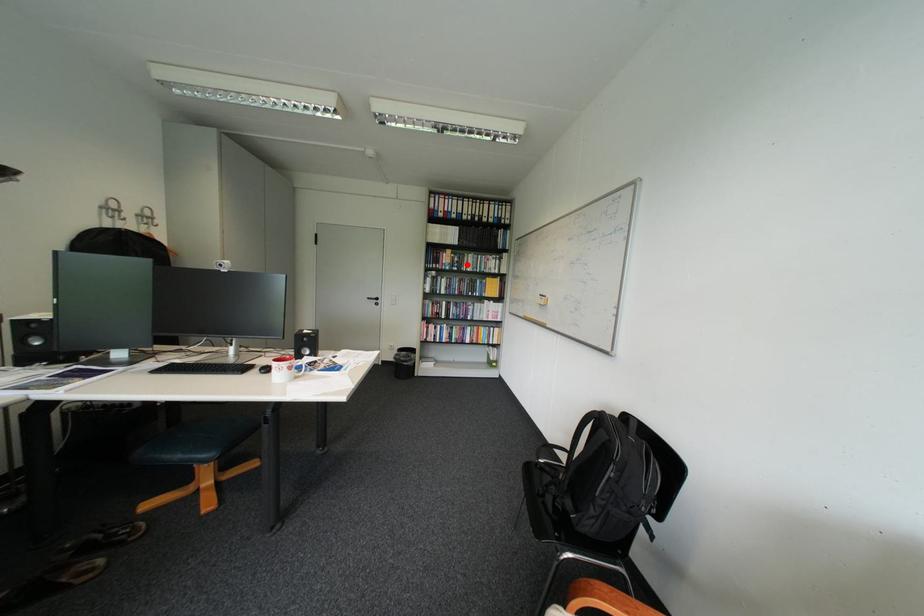
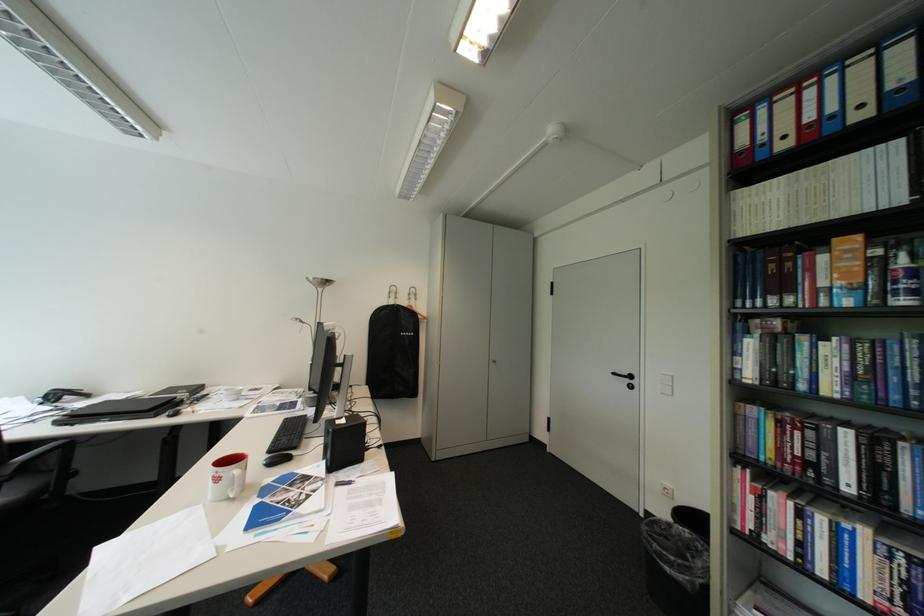
Locate, in the second image, the point that corresponds to the highlighted location in the first image.

(907, 284)